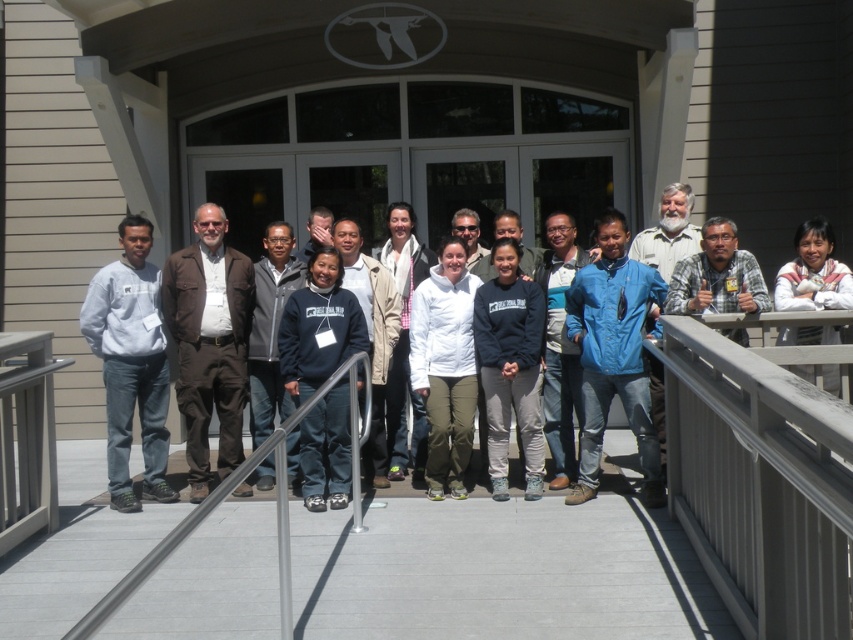
Question: Is brown leather jacket at center to the right of silver metallic handrail at center from the viewer's perspective?

Choices:
 (A) no
 (B) yes

Answer: (A)

Question: Which of the following is the farthest from the observer?

Choices:
 (A) (821, 296)
 (B) (119, 486)
 (C) (26, 579)
 (D) (688, 257)

Answer: (B)

Question: Does smooth concrete porch at center have a larger size compared to beige textured shirt at right?

Choices:
 (A) no
 (B) yes

Answer: (B)

Question: Which of the following is the closest to the observer?

Choices:
 (A) gray wood balustrade at right
 (B) smooth concrete porch at center
 (C) matte brown jacket at center
 (D) blue fabric shirt at center

Answer: (A)

Question: Which object is the closest to the blue fabric jacket at center?

Choices:
 (A) white fleece jacket at center
 (B) smooth concrete porch at center
 (C) silver metallic handrail at center

Answer: (B)

Question: Can you confirm if silver metallic handrail at center is positioned to the right of khaki cotton jacket at center?

Choices:
 (A) no
 (B) yes

Answer: (A)